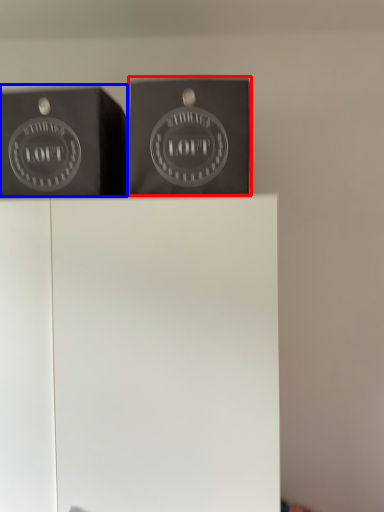
Question: Which of the following is the closest to the observer, package (highlighted by a red box) or writing (highlighted by a blue box)?

Choices:
 (A) package
 (B) writing

Answer: (A)